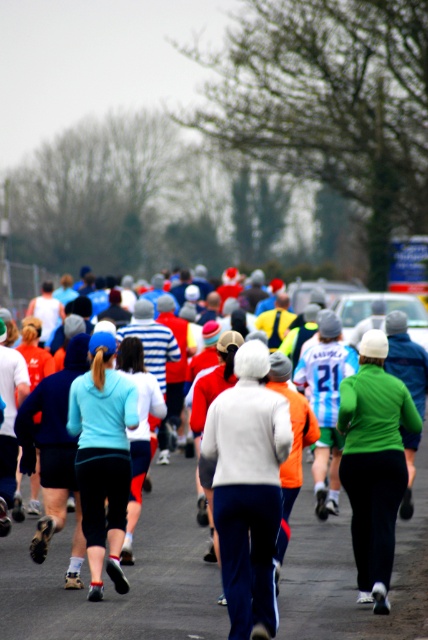
You are a photographer positioned at the starting line of the marathon. You want to capture both the white fleece jacket at center and the light blue jersey at center in a single frame. Which of the two should you focus on first to ensure both are in the frame?

You should focus on the white fleece jacket at center first because it has a larger size compared to the light blue jersey at center, allowing you to frame both effectively by centering the larger object first.

You are a photographer positioned at the starting line of the marathon. You need to capture a photo that includes both the matte white jacket at center and the light blue jersey at center. Based on their heights, which one might you adjust your camera angle to focus on first?

The matte white jacket at center is shorter than the light blue jersey at center, so you should focus on the matte white jacket at center first to ensure it is fully in frame before adjusting for the taller light blue jersey at center.